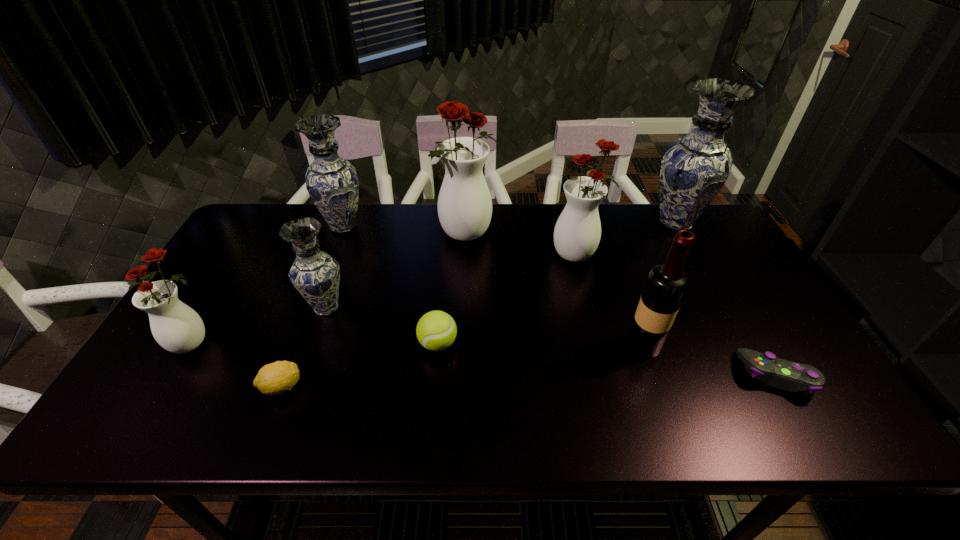
Locate an element on the screen. control that is positioned at the right edge is located at coordinates (790, 376).

The image size is (960, 540). What are the coordinates of `object that is positioned at the far right corner` in the screenshot? It's located at (695, 167).

Image resolution: width=960 pixels, height=540 pixels. Identify the location of object located at the near right corner. (790, 376).

Identify the location of free space at the far edge of the desktop. (408, 210).

In the image, there is a desktop. Where is `vacant space at the near edge`? This screenshot has width=960, height=540. vacant space at the near edge is located at coordinates (225, 418).

In the image, there is a desktop. Where is `vacant area at the left edge`? This screenshot has width=960, height=540. vacant area at the left edge is located at coordinates (214, 335).

Locate an element on the screen. The image size is (960, 540). vacant space at the right edge of the desktop is located at coordinates (744, 274).

This screenshot has width=960, height=540. I want to click on free location at the far left corner, so click(277, 206).

Identify the location of empty space that is in between the tennis ball and the second smallest blue vase. The height and width of the screenshot is (540, 960). (391, 285).

The height and width of the screenshot is (540, 960). In order to click on free area in between the second nearest vase and the lemon in this screenshot , I will do `click(304, 348)`.